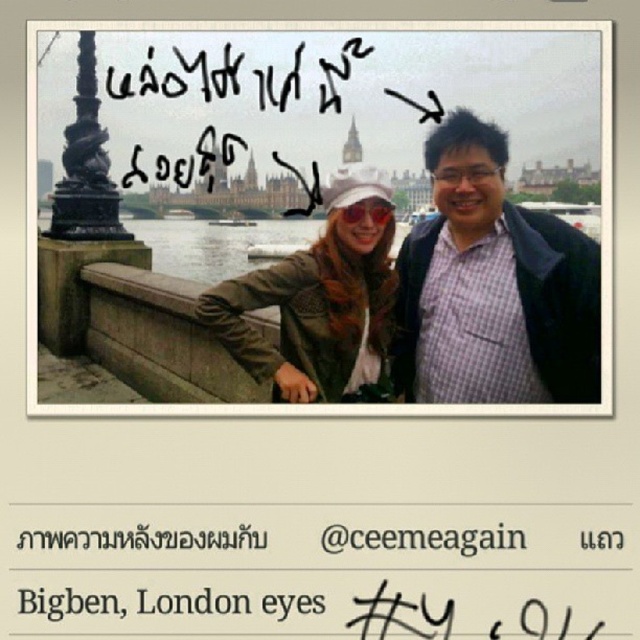
Does point (564, 326) come behind point (244, 275)?

No, it is in front of (244, 275).

Can you confirm if matte plaid shirt at center is thinner than matte olive-green jacket at center?

Indeed, matte plaid shirt at center has a lesser width compared to matte olive-green jacket at center.

Locate an element on the screen. matte plaid shirt at center is located at coordinates (492, 285).

Who is shorter, matte plaid shirt at center or concrete ledge at lower left?

concrete ledge at lower left

Is point (586, 282) farther from camera compared to point (120, 339)?

No, it is not.

Where is `matte plaid shirt at center`? The height and width of the screenshot is (640, 640). matte plaid shirt at center is located at coordinates (492, 285).

Who is higher up, matte olive-green jacket at center or concrete ledge at lower left?

matte olive-green jacket at center is higher up.

Is matte olive-green jacket at center thinner than concrete ledge at lower left?

Indeed, matte olive-green jacket at center has a lesser width compared to concrete ledge at lower left.

Between point (356, 264) and point (189, 291), which one is positioned behind?

The point (189, 291) is more distant.

At what (x,y) coordinates should I click in order to perform the action: click on matte olive-green jacket at center. Please return your answer as a coordinate pair (x, y). This screenshot has width=640, height=640. Looking at the image, I should click on (320, 300).